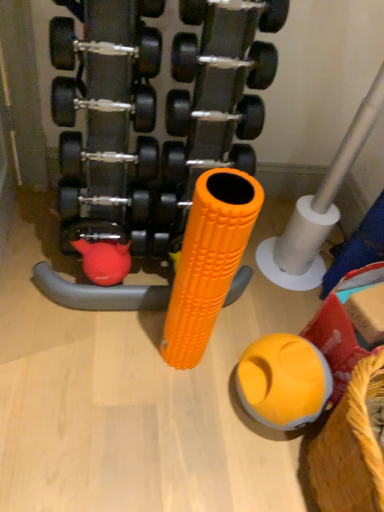
Locate an element on the screen. The width and height of the screenshot is (384, 512). vacant region to the left of rubberized yellow ball at lower right is located at coordinates 203,396.